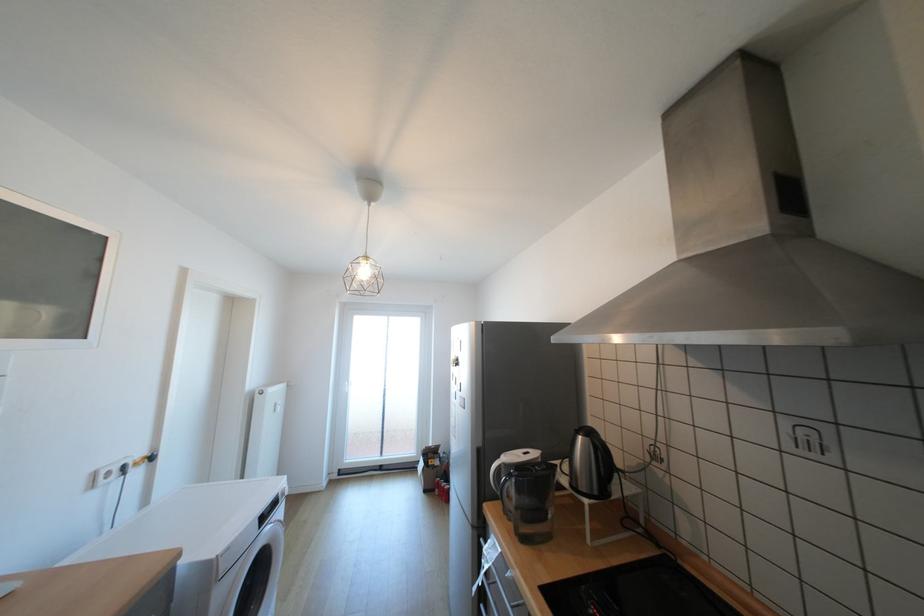
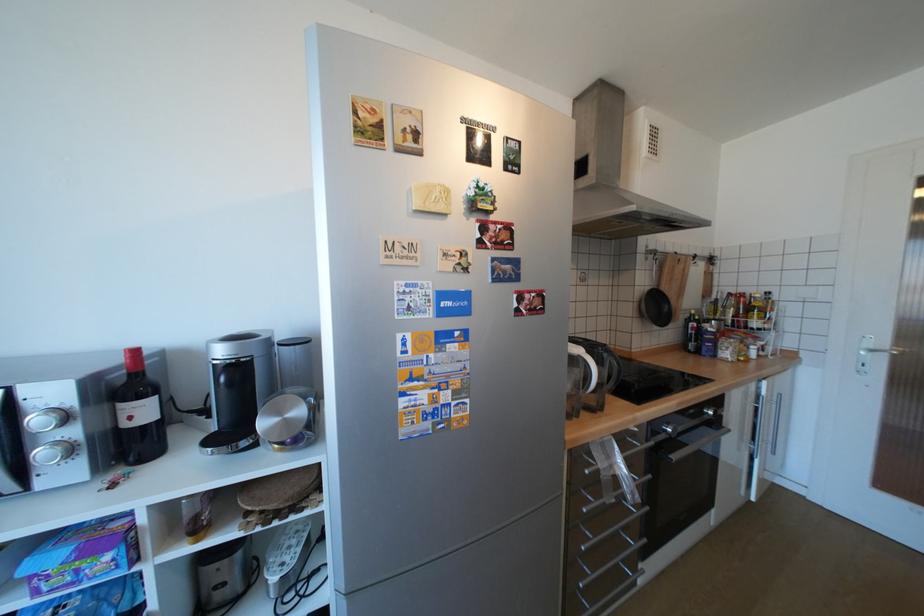
The point at (502, 562) is marked in the first image. Where is the corresponding point in the second image?

(630, 452)